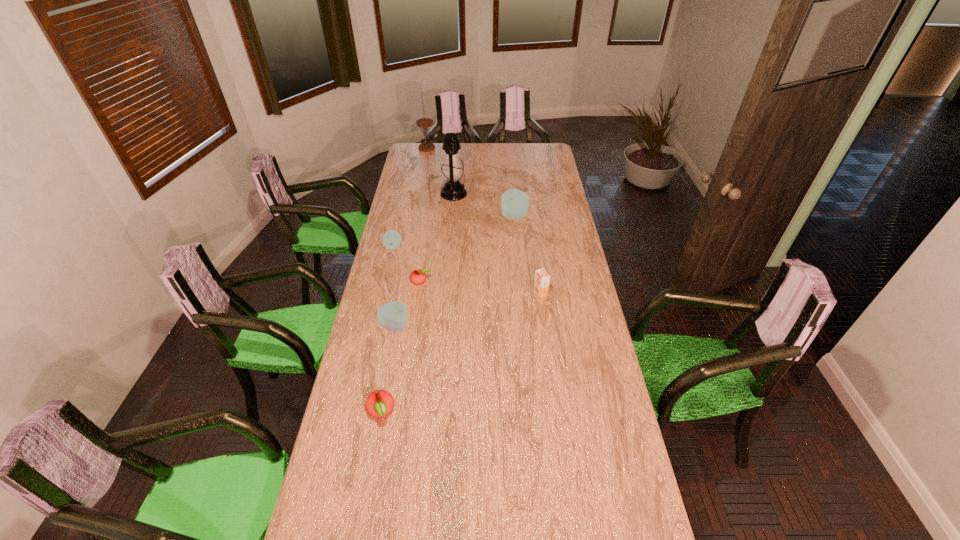
Image resolution: width=960 pixels, height=540 pixels. I want to click on free space between the farthest object and the farthest white apple, so click(470, 183).

This screenshot has height=540, width=960. I want to click on vacant area that lies between the fifth farthest object and the second nearest apple, so click(x=408, y=303).

The width and height of the screenshot is (960, 540). Identify the location of vacant space that's between the second tallest apple and the nearer red apple. (388, 369).

Image resolution: width=960 pixels, height=540 pixels. Find the location of `vacant space in between the hourglass and the nearest white apple`. vacant space in between the hourglass and the nearest white apple is located at coordinates (411, 237).

Locate an element on the screen. This screenshot has width=960, height=540. free space that is in between the farther red apple and the black oil lamp is located at coordinates (437, 237).

Identify the location of free spot between the second biggest white apple and the hourglass. This screenshot has height=540, width=960. (411, 237).

Locate an element on the screen. The image size is (960, 540). vacant area that lies between the farthest object and the fourth farthest object is located at coordinates (410, 198).

Locate an element on the screen. The height and width of the screenshot is (540, 960). vacant area that lies between the smaller red apple and the orange juice is located at coordinates (481, 287).

Find the location of a particular element. This screenshot has height=540, width=960. vacant point located between the shortest apple and the second biggest white apple is located at coordinates (408, 303).

Locate an element on the screen. The height and width of the screenshot is (540, 960). object that ranks as the fourth closest to the nearer red apple is located at coordinates click(391, 239).